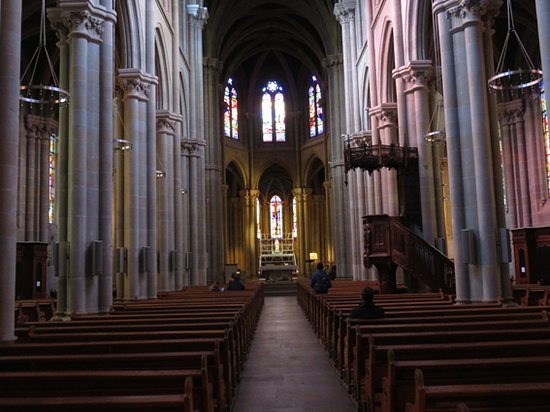
The image size is (550, 412). Identify the location of stairs. (400, 250), (411, 207).